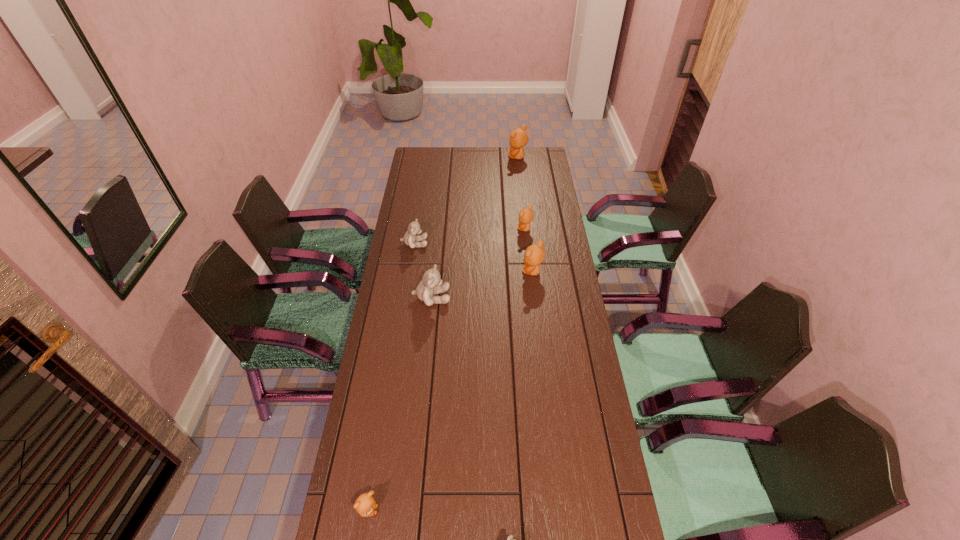
Locate an element on the screen. This screenshot has width=960, height=540. the biggest brown teddy bear is located at coordinates (518, 138).

Find the location of a particular element. This screenshot has height=540, width=960. the farthest object is located at coordinates (518, 138).

Locate an element on the screen. The width and height of the screenshot is (960, 540). the second biggest brown teddy bear is located at coordinates (534, 255).

The image size is (960, 540). In order to click on the second nearest brown teddy bear in this screenshot , I will do `click(534, 255)`.

Find the location of a particular element. Image resolution: width=960 pixels, height=540 pixels. the biggest gray teddy bear is located at coordinates (431, 284).

I want to click on the third nearest object, so click(431, 284).

Where is `the second farthest object`? the second farthest object is located at coordinates (526, 215).

The width and height of the screenshot is (960, 540). Identify the location of the sixth nearest teddy bear. (526, 215).

Locate an element on the screen. the third farthest object is located at coordinates click(x=410, y=238).

Identify the location of the farthest gray teddy bear. Image resolution: width=960 pixels, height=540 pixels. (410, 238).